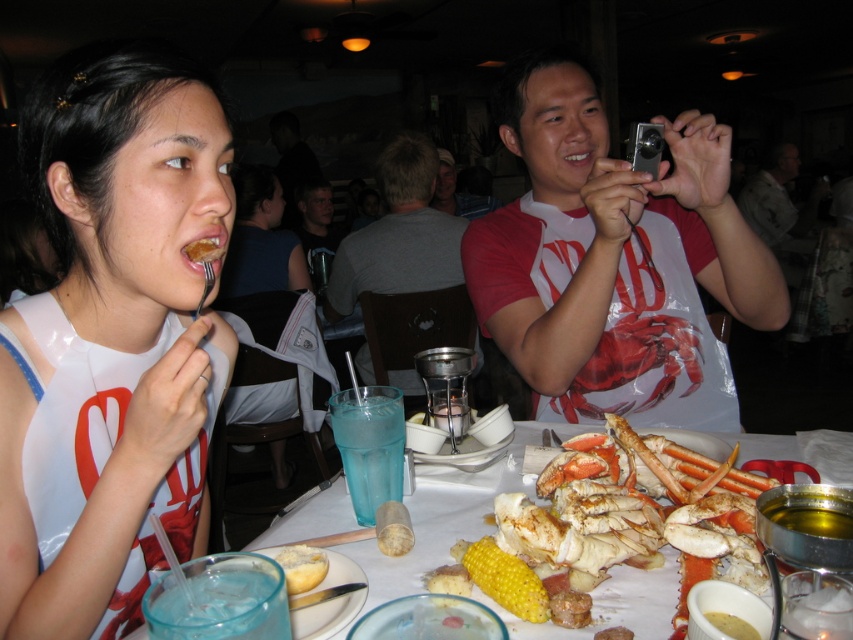
Who is more forward, (148, 564) or (305, 566)?

Point (305, 566) is more forward.

Looking at this image, between matte white shirt at upper left and golden bread at center, which one is positioned lower?

Positioned lower is golden bread at center.

This screenshot has width=853, height=640. I want to click on matte white shirt at upper left, so click(113, 337).

Between point (746, 260) and point (544, 540), which one is positioned in front?

Positioned in front is point (544, 540).

Between matte silver camera at upper right and golden corn cob at center, which one appears on the left side from the viewer's perspective?

golden corn cob at center

Where is `matte silver camera at upper right`? Image resolution: width=853 pixels, height=640 pixels. matte silver camera at upper right is located at coordinates (614, 260).

Does matte white shirt at upper left appear on the left side of gray fabric shirt at center?

Indeed, matte white shirt at upper left is positioned on the left side of gray fabric shirt at center.

Does matte white shirt at upper left have a greater width compared to gray fabric shirt at center?

Incorrect, matte white shirt at upper left's width does not surpass gray fabric shirt at center's.

This screenshot has height=640, width=853. In order to click on matte white shirt at upper left in this screenshot , I will do `click(113, 337)`.